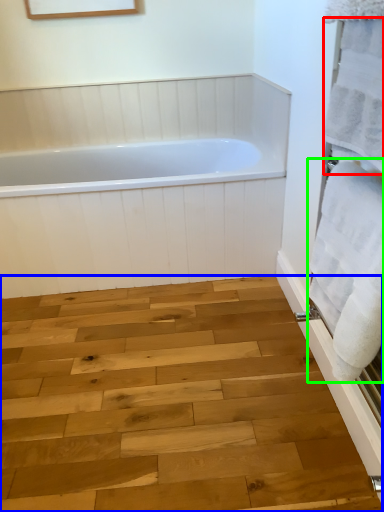
Question: Estimate the real-world distances between objects in this image. Which object is closer to bath towel (highlighted by a red box), plank (highlighted by a blue box) or bath towel (highlighted by a green box)?

Choices:
 (A) plank
 (B) bath towel

Answer: (B)